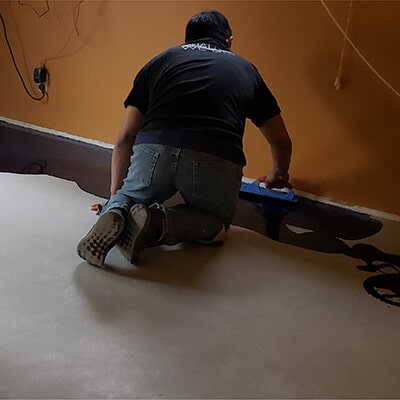
Where is `grey flooring`? This screenshot has height=400, width=400. grey flooring is located at coordinates (235, 349).